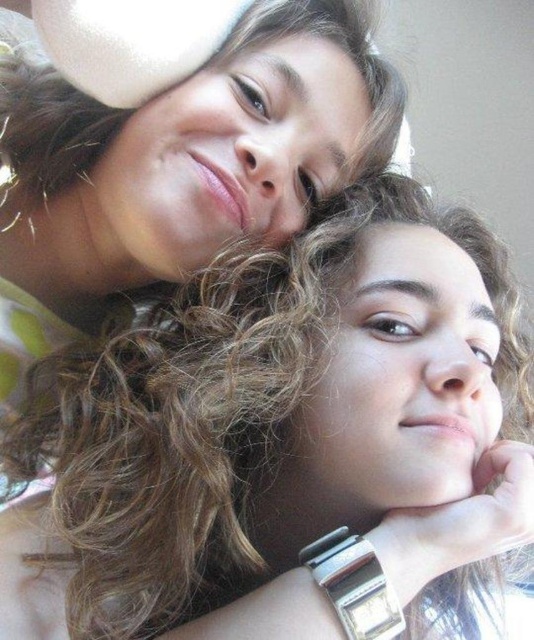
Question: Does curly hair at center appear on the right side of silver metallic watch at lower center?

Choices:
 (A) yes
 (B) no

Answer: (A)

Question: Can you confirm if curly hair at center is positioned below silver metallic watch at lower center?

Choices:
 (A) yes
 (B) no

Answer: (B)

Question: Can you confirm if curly hair at center is thinner than silver metallic watch at lower center?

Choices:
 (A) no
 (B) yes

Answer: (A)

Question: Which of the following is the closest to the observer?

Choices:
 (A) (340, 609)
 (B) (242, 276)

Answer: (A)

Question: Which point is farther to the camera?

Choices:
 (A) (341, 592)
 (B) (106, 358)

Answer: (B)